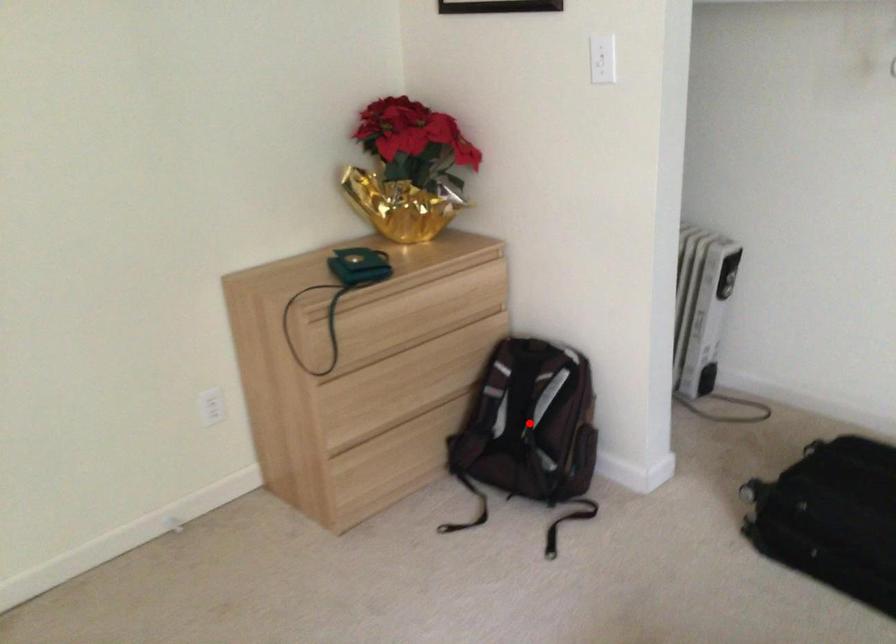
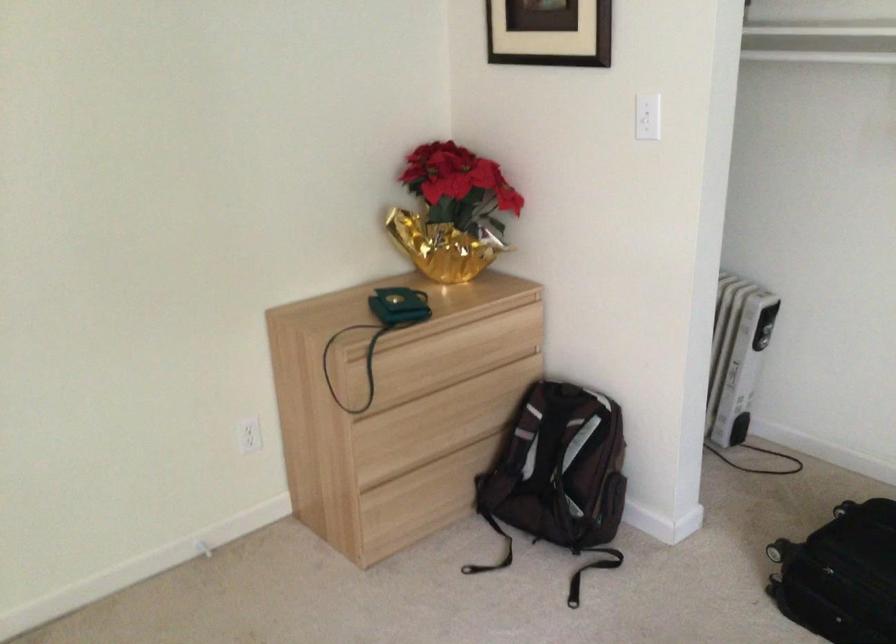
Where in the second image is the point corresponding to the highlighted location from the first image?

(558, 468)